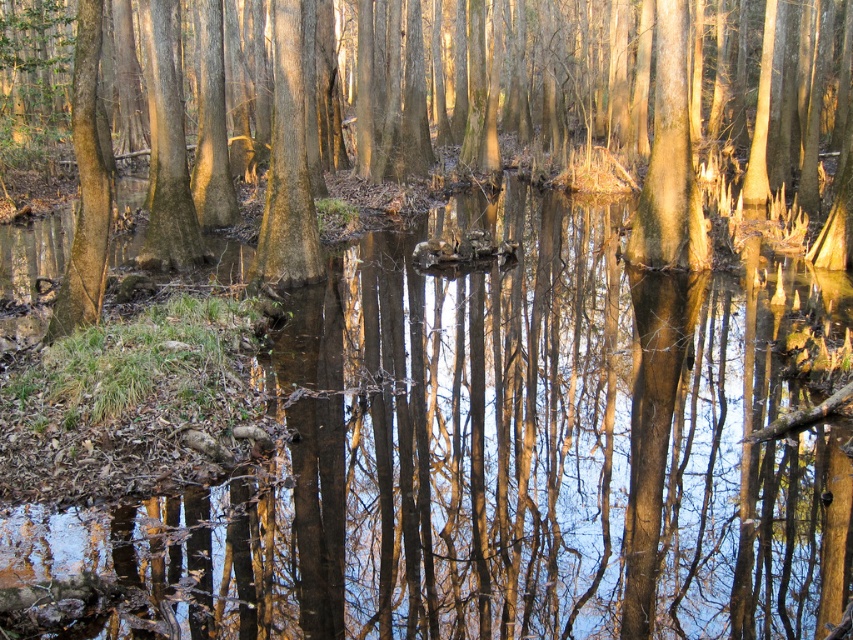
You are standing in the swamp and want to walk towards the point at the bottom right of the image. Which point should you head towards, point at coordinate [312,570] or point at coordinate [245,125]?

You should head towards point at coordinate [312,570] because it is located in front of point at coordinate [245,125], meaning it is closer to your current position.

You are a kayaker navigating through the swamp. You see the clear water at center and the smooth brown tree trunk at center. Which one is taller?

The smooth brown tree trunk at center is taller than the clear water at center.